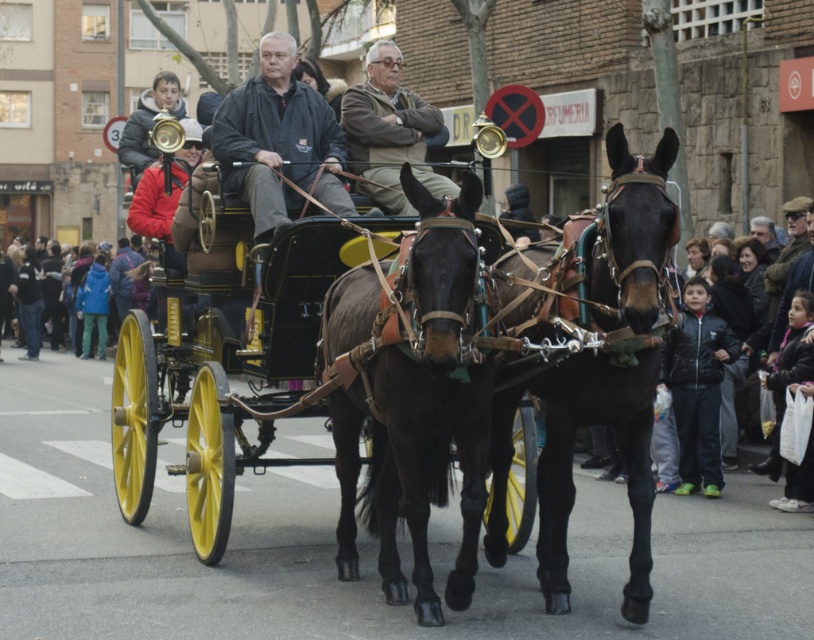
Which of these two, shiny brass carriage at center or gray wool sweater at center, stands shorter?

With less height is gray wool sweater at center.

Does shiny brass carriage at center appear under gray wool sweater at center?

Yes.

Which is behind, point (511, 371) or point (346, 109)?

The point (346, 109) is behind.

Where is `shiny brass carriage at center`? This screenshot has height=640, width=814. shiny brass carriage at center is located at coordinates (594, 372).

Is point (451, 394) positioned after point (422, 108)?

No, (451, 394) is closer to viewer.

Is point (414, 483) positioned in front of point (399, 125)?

Yes, point (414, 483) is in front of point (399, 125).

Is point (435, 620) in front of point (388, 189)?

Yes, point (435, 620) is in front of point (388, 189).

Image resolution: width=814 pixels, height=640 pixels. Find the location of `black leather horse at center`. black leather horse at center is located at coordinates (414, 400).

Between shiny brass carriage at center and black leather horse at center, which one appears on the left side from the viewer's perspective?

From the viewer's perspective, black leather horse at center appears more on the left side.

Is shiny brass carriage at center behind black leather horse at center?

Yes, shiny brass carriage at center is further from the viewer.

Is point (387, 436) in front of point (409, 330)?

No, (387, 436) is behind (409, 330).

You are a GUI agent. You are given a task and a screenshot of the screen. Output one action in this format:
    pyautogui.click(x=<x>, y=<y>)
    Task: Click on the shiny brass carriage at center
    This screenshot has width=814, height=640.
    Given the screenshot: What is the action you would take?
    pyautogui.click(x=594, y=372)